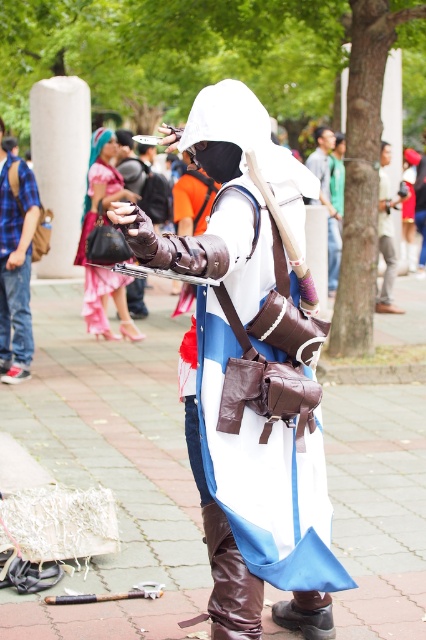
Question: Which of the following is the farthest from the observer?

Choices:
 (A) (328, 554)
 (B) (333, 221)
 (C) (0, 262)

Answer: (B)

Question: Which is nearer to the brown leather backpack at center?

Choices:
 (A) brushed metal backpack at left
 (B) brown leather pants at center
 (C) white leather gloves at center

Answer: (B)

Question: Does white leather gloves at center have a smaller size compared to brown leather backpack at center?

Choices:
 (A) no
 (B) yes

Answer: (A)

Question: Is white leather gloves at center to the left of brown leather backpack at center from the viewer's perspective?

Choices:
 (A) yes
 (B) no

Answer: (A)

Question: Does brushed metal backpack at left lie behind brown leather pants at center?

Choices:
 (A) no
 (B) yes

Answer: (A)

Question: Which of the following is the closest to the observer?

Choices:
 (A) brown leather backpack at center
 (B) brushed metal backpack at left
 (C) white leather gloves at center

Answer: (C)